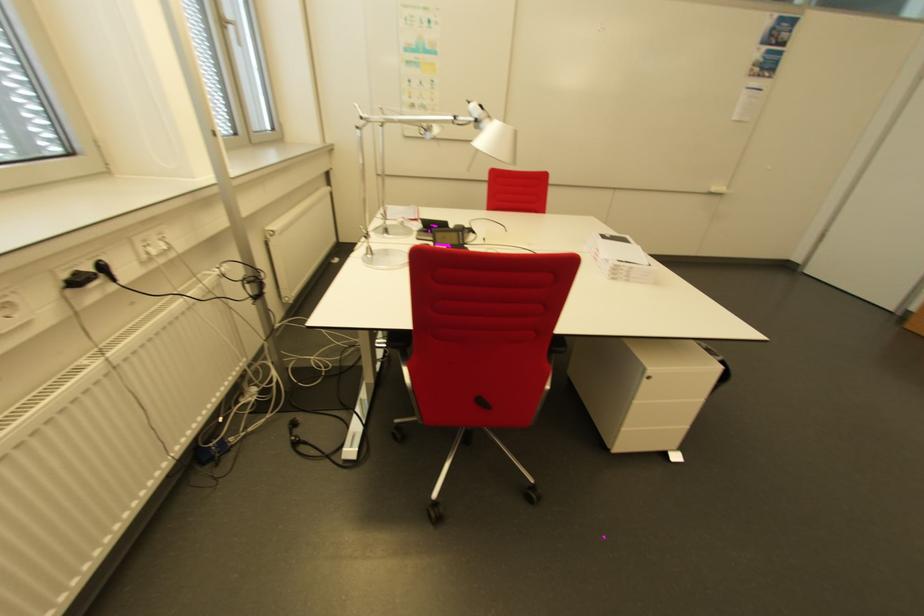
Where would you pull the chair adjustment lever? Please return your answer as a coordinate pair (x, y).

(480, 405)